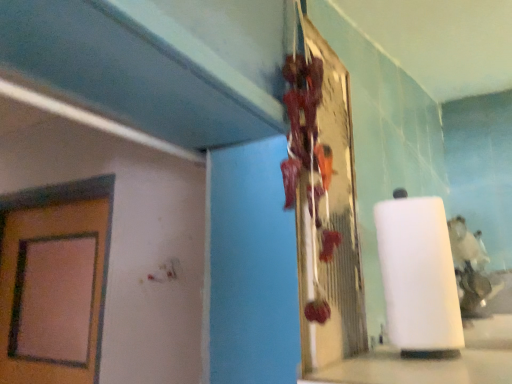
Measure the distance between point (330, 154) and camera.

80.00 centimeters.

Locate an element on the screen. The image size is (512, 384). metallic reflective board at center is located at coordinates (331, 222).

What do you see at coordinates (331, 222) in the screenshot? The width and height of the screenshot is (512, 384). I see `metallic reflective board at center` at bounding box center [331, 222].

Measure the distance between point (423, 277) and camera.

The distance of point (423, 277) from camera is 29.21 inches.

The width and height of the screenshot is (512, 384). What do you see at coordinates (418, 274) in the screenshot?
I see `white matte paper towel at center` at bounding box center [418, 274].

Find the location of `white matte paper towel at center`. white matte paper towel at center is located at coordinates (418, 274).

In order to face white matte paper towel at center, should I rotate leftwards or rightwards?

To align with it, rotate right about 22.955°.

At what (x,y) coordinates should I click in order to perform the action: click on metallic reflective board at center. Please return your answer as a coordinate pair (x, y). The width and height of the screenshot is (512, 384). Looking at the image, I should click on (331, 222).

Between metallic reflective board at center and white matte paper towel at center, which one appears on the left side from the viewer's perspective?

Positioned to the left is metallic reflective board at center.

Which is in front, metallic reflective board at center or white matte paper towel at center?

Positioned in front is metallic reflective board at center.

Between point (358, 308) and point (434, 236), which one is positioned in front?

The point (434, 236) is more forward.

From the image's perspective, which is below, metallic reflective board at center or white matte paper towel at center?

white matte paper towel at center, from the image's perspective.

From a real-world perspective, is metallic reflective board at center above or below white matte paper towel at center?

metallic reflective board at center is situated higher than white matte paper towel at center in the real world.

Looking at this image, between metallic reflective board at center and white matte paper towel at center, which one has smaller width?

metallic reflective board at center is thinner.

Who is taller, metallic reflective board at center or white matte paper towel at center?

metallic reflective board at center.

Considering the relative sizes of metallic reflective board at center and white matte paper towel at center in the image provided, is metallic reflective board at center bigger than white matte paper towel at center?

Yes, metallic reflective board at center is bigger than white matte paper towel at center.

Choose the correct answer: Is metallic reflective board at center inside white matte paper towel at center or outside it?

metallic reflective board at center is not enclosed by white matte paper towel at center.

Are metallic reflective board at center and white matte paper towel at center far apart?

No, metallic reflective board at center is in close proximity to white matte paper towel at center.

Could you tell me if metallic reflective board at center is facing white matte paper towel at center?

No, metallic reflective board at center does not turn towards white matte paper towel at center.

What's the angular difference between metallic reflective board at center and white matte paper towel at center's facing directions?

The angle between the facing direction of metallic reflective board at center and the facing direction of white matte paper towel at center is 0.00137 degrees.

Identify the location of bulletin board on the left of white matte paper towel at center. (331, 222).

Between white matte paper towel at center and metallic reflective board at center, which one appears on the right side from the viewer's perspective?

white matte paper towel at center.

Is white matte paper towel at center behind metallic reflective board at center?

Yes, white matte paper towel at center is further from the camera.

Is point (452, 295) closer to camera compared to point (321, 155)?

No, (452, 295) is behind (321, 155).

From the image's perspective, relative to metallic reflective board at center, is white matte paper towel at center above or below?

Clearly, from the image's perspective, white matte paper towel at center is below metallic reflective board at center.

From a real-world perspective, is white matte paper towel at center physically below metallic reflective board at center?

Yes, from a real-world perspective, white matte paper towel at center is under metallic reflective board at center.

Between white matte paper towel at center and metallic reflective board at center, which one has larger width?

white matte paper towel at center is wider.

Is white matte paper towel at center taller or shorter than metallic reflective board at center?

Considering their sizes, white matte paper towel at center has less height than metallic reflective board at center.

Which of these two, white matte paper towel at center or metallic reflective board at center, is smaller?

With smaller size is white matte paper towel at center.

Is white matte paper towel at center completely or partially outside of metallic reflective board at center?

Indeed, white matte paper towel at center is completely outside metallic reflective board at center.

Is white matte paper towel at center not near metallic reflective board at center?

They are positioned close to each other.

Is white matte paper towel at center facing away from metallic reflective board at center?

white matte paper towel at center does not have its back to metallic reflective board at center.

Can you tell me how much white matte paper towel at center and metallic reflective board at center differ in facing direction?

The angular difference between white matte paper towel at center and metallic reflective board at center is 0.00137 degrees.

This screenshot has width=512, height=384. I want to click on bulletin board above the white matte paper towel at center (from a real-world perspective), so click(331, 222).

Where is `bulletin board on the left of white matte paper towel at center`? Image resolution: width=512 pixels, height=384 pixels. bulletin board on the left of white matte paper towel at center is located at coordinates (331, 222).

At what (x,y) coordinates should I click in order to perform the action: click on paper towel lying below the metallic reflective board at center (from the image's perspective). Please return your answer as a coordinate pair (x, y). Image resolution: width=512 pixels, height=384 pixels. Looking at the image, I should click on (418, 274).